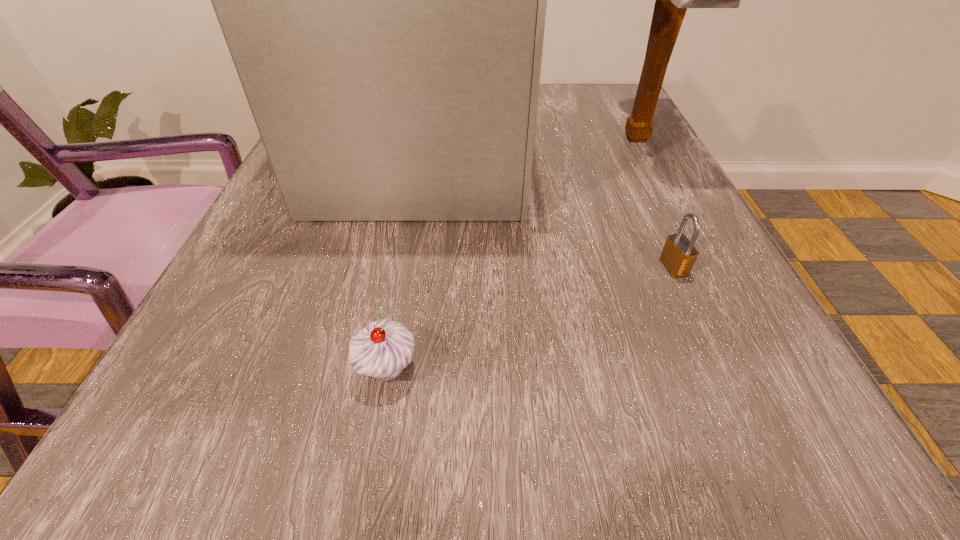
This screenshot has width=960, height=540. I want to click on toaster oven at the far edge, so click(x=383, y=0).

Where is `mallet located in the far edge section of the desktop`? The height and width of the screenshot is (540, 960). mallet located in the far edge section of the desktop is located at coordinates (672, 0).

Identify the location of object at the left edge. (383, 0).

This screenshot has width=960, height=540. In order to click on mallet positioned at the right edge in this screenshot , I will do `click(672, 0)`.

You are a GUI agent. You are given a task and a screenshot of the screen. Output one action in this format:
    pyautogui.click(x=<x>, y=<y>)
    Task: Click on the padlock positioned at the right edge
    This screenshot has height=540, width=960.
    Given the screenshot: What is the action you would take?
    pyautogui.click(x=679, y=254)

Where is `object that is at the far left corner`? This screenshot has width=960, height=540. object that is at the far left corner is located at coordinates (383, 0).

Locate an element on the screen. This screenshot has height=540, width=960. object situated at the far right corner is located at coordinates pyautogui.click(x=672, y=0).

In the image, there is a desktop. Identify the location of vacant space at the far edge. (540, 118).

In the image, there is a desktop. Identify the location of free space at the near edge. This screenshot has width=960, height=540. point(670,477).

I want to click on blank area at the left edge, so click(285, 404).